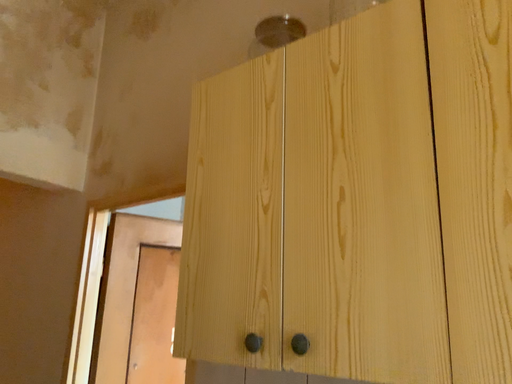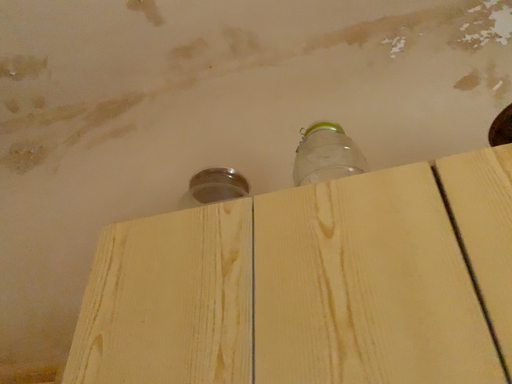
Question: How did the camera likely rotate when shooting the video?

Choices:
 (A) rotated upward
 (B) rotated downward

Answer: (A)